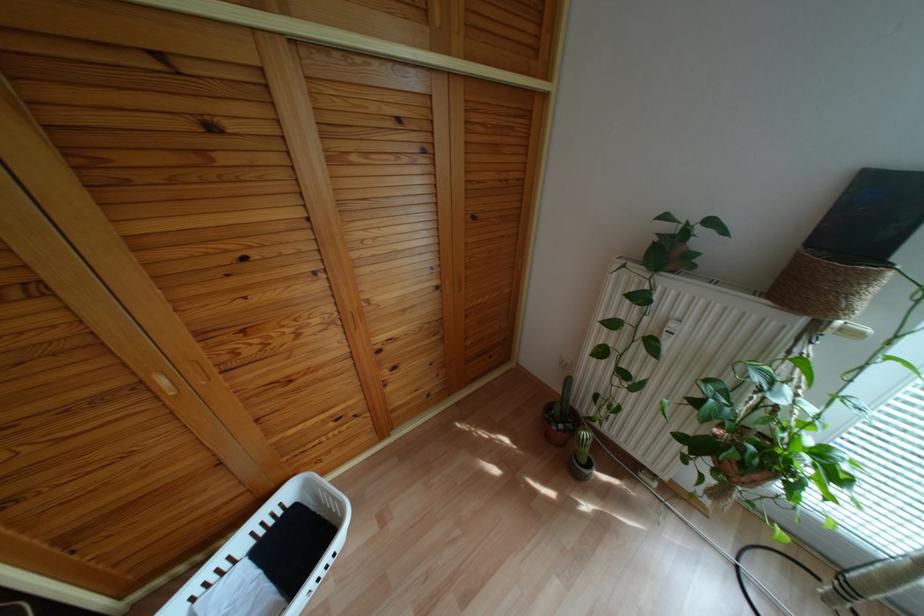
The image size is (924, 616). What are the coordinates of `radiator thermostat knob` in the screenshot? It's located at (848, 330).